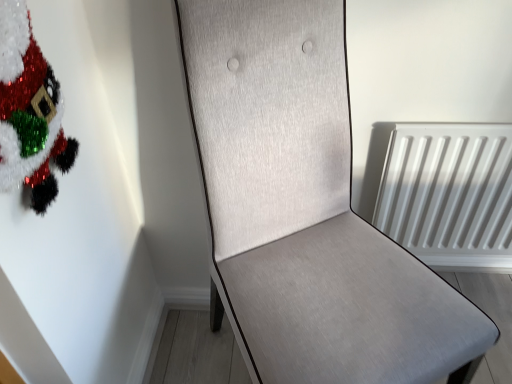
Question: Is point (45, 69) positioned closer to the camera than point (377, 309)?

Choices:
 (A) farther
 (B) closer

Answer: (B)

Question: Considering the positions of fuzzy tinsel santa at upper left and light gray fabric chair at center in the image, is fuzzy tinsel santa at upper left taller or shorter than light gray fabric chair at center?

Choices:
 (A) short
 (B) tall

Answer: (A)

Question: From the image's perspective, is fuzzy tinsel santa at upper left positioned above or below light gray fabric chair at center?

Choices:
 (A) above
 (B) below

Answer: (A)

Question: Is light gray fabric chair at center bigger or smaller than fuzzy tinsel santa at upper left?

Choices:
 (A) big
 (B) small

Answer: (A)

Question: From the image's perspective, is light gray fabric chair at center above or below fuzzy tinsel santa at upper left?

Choices:
 (A) below
 (B) above

Answer: (A)

Question: Considering the positions of light gray fabric chair at center and fuzzy tinsel santa at upper left in the image, is light gray fabric chair at center wider or thinner than fuzzy tinsel santa at upper left?

Choices:
 (A) thin
 (B) wide

Answer: (B)

Question: Is light gray fabric chair at center taller or shorter than fuzzy tinsel santa at upper left?

Choices:
 (A) tall
 (B) short

Answer: (A)